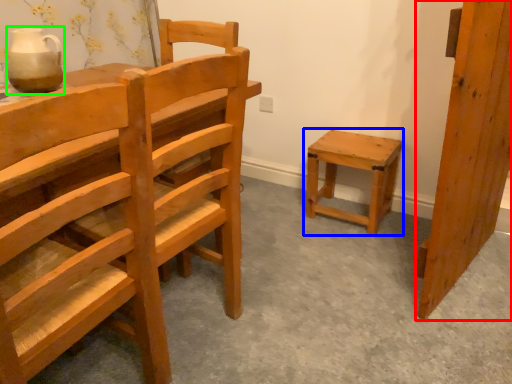
Question: Which object is the farthest from wood (highlighted by a red box)? Choose among these: stool (highlighted by a blue box) or pottery (highlighted by a green box).

Choices:
 (A) stool
 (B) pottery

Answer: (B)